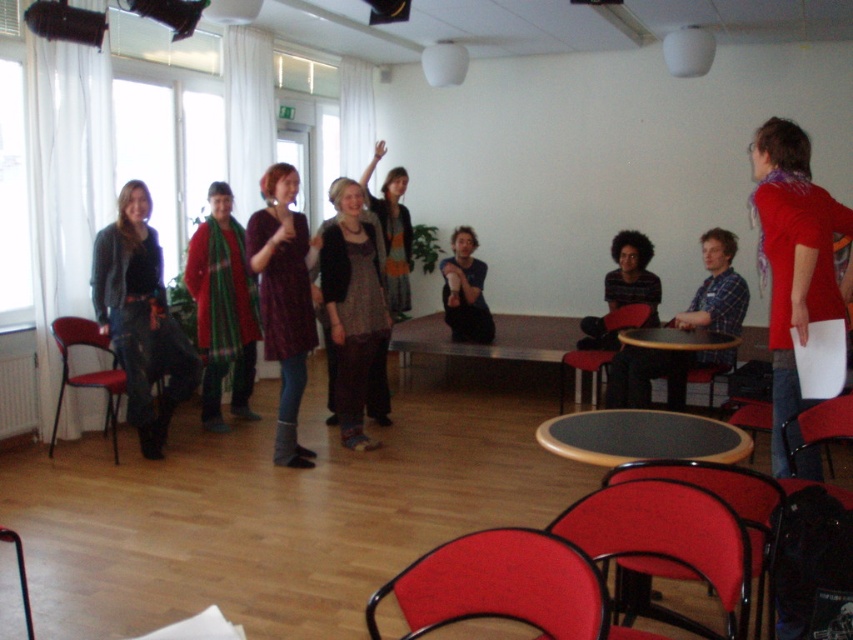
Question: Can you confirm if red scarf at center is thinner than dark blue jeans at center?

Choices:
 (A) no
 (B) yes

Answer: (A)

Question: Is red fabric chair at lower center thinner than leather-like red chair at lower right?

Choices:
 (A) no
 (B) yes

Answer: (A)

Question: Among these points, which one is nearest to the camera?

Choices:
 (A) (32, 637)
 (B) (708, 278)

Answer: (A)

Question: Which object appears farthest from the camera in this image?

Choices:
 (A) matte gray sweater at center
 (B) red fabric chair at lower right

Answer: (A)

Question: Does matte gray sweater at center have a lesser width compared to matte red chair at left?

Choices:
 (A) no
 (B) yes

Answer: (B)

Question: Which object is the farthest from the denim jeans at left?

Choices:
 (A) red fabric chair at lower center
 (B) leather-like red chair at lower right
 (C) matte purple dress at center
 (D) matte red chair at left

Answer: (A)